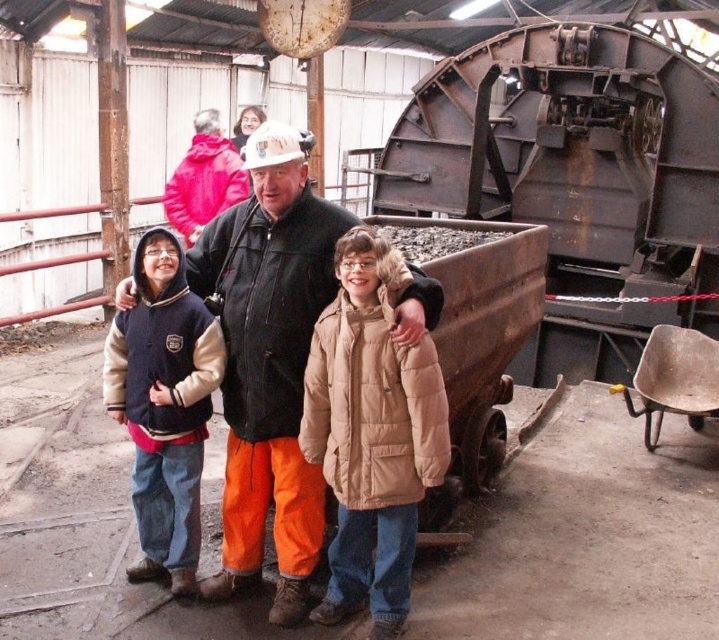
Question: Which point is closer to the camera?

Choices:
 (A) (170, 285)
 (B) (362, 332)
 (C) (249, 150)

Answer: (B)

Question: Is tan puffy coat at center above velvet navy jacket at left?

Choices:
 (A) no
 (B) yes

Answer: (A)

Question: Is the position of matte black jacket at center more distant than that of tan puffy coat at center?

Choices:
 (A) yes
 (B) no

Answer: (A)

Question: Estimate the real-world distances between objects in this image. Which object is farther from the matte black jacket at center?

Choices:
 (A) tan puffy coat at center
 (B) velvet navy jacket at left

Answer: (A)

Question: Estimate the real-world distances between objects in this image. Which object is closer to the tan puffy coat at center?

Choices:
 (A) velvet navy jacket at left
 (B) matte black jacket at center

Answer: (B)

Question: Is the position of tan puffy coat at center less distant than that of velvet navy jacket at left?

Choices:
 (A) no
 (B) yes

Answer: (B)